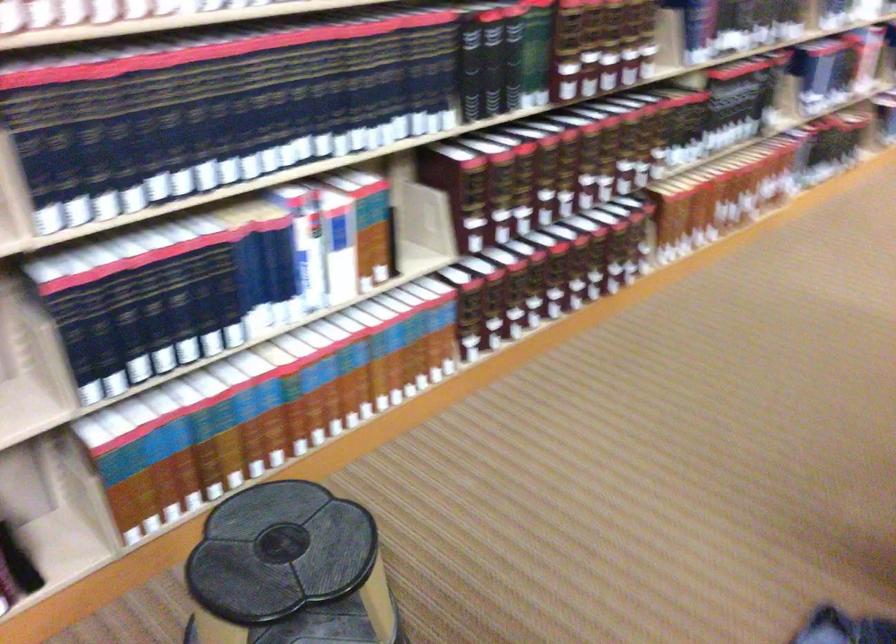
I want to click on beige book divider, so point(421,228).